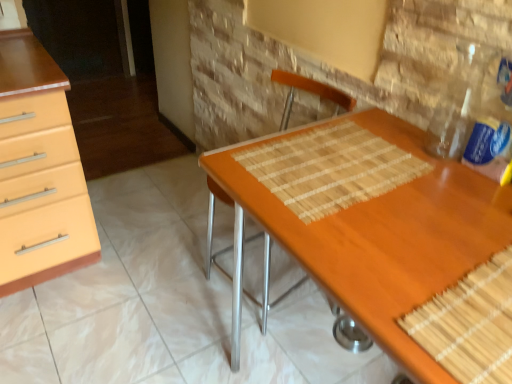
Find the location of `free spot in front of clear plastic bottle at upper right`. free spot in front of clear plastic bottle at upper right is located at coordinates (479, 207).